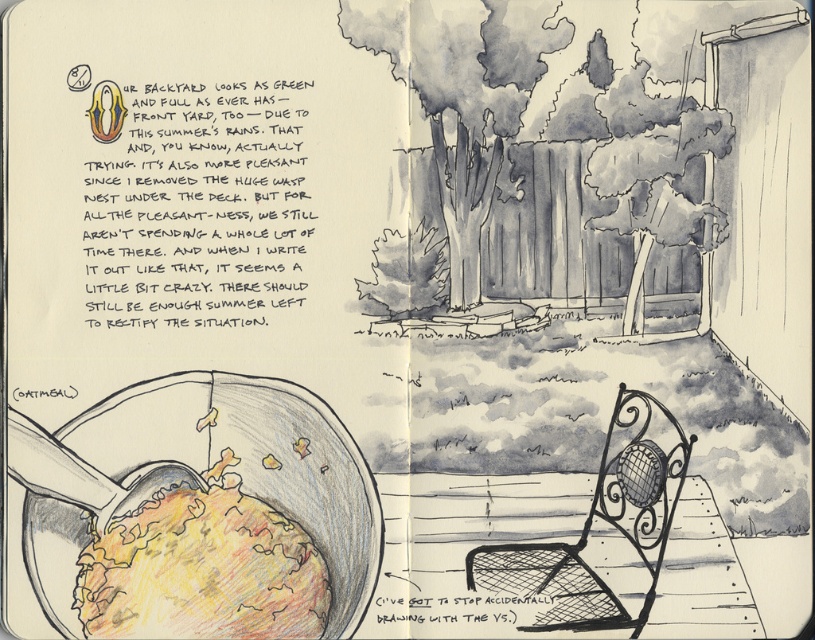
You are a cat observing the scene from the left page of the sketchbook. You see the yellow crumbly food at lower left and the wrought iron chair at center. Which object is closer to the left edge of the page?

The yellow crumbly food at lower left is closer to the left edge of the page since it is positioned to the left of the wrought iron chair at center.

You are a dog who just arrived at the backyard. You see the yellow crumbly food at lower left and the wrought iron chair at center. Which one is closer to you?

The yellow crumbly food at lower left is closer to you since it is only 5.81 inches away from the wrought iron chair at center, which is your current position.